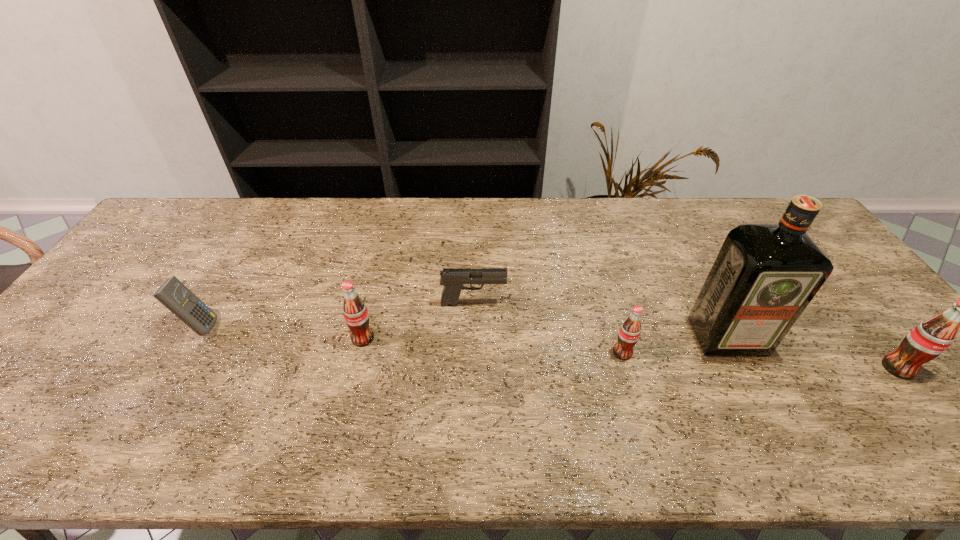
You are a GUI agent. You are given a task and a screenshot of the screen. Output one action in this format:
    pyautogui.click(x=<x>, y=<y>)
    Task: Click on the unoccupied position between the second soda from left to right and the fifth object from left to right
    Image resolution: width=960 pixels, height=540 pixels.
    Given the screenshot: What is the action you would take?
    pyautogui.click(x=675, y=345)

Locate an element on the screen. The image size is (960, 540). vacant area that lies between the rightmost object and the farthest object is located at coordinates (685, 335).

You are a GUI agent. You are given a task and a screenshot of the screen. Output one action in this format:
    pyautogui.click(x=<x>, y=<y>)
    Task: Click on the unoccupied position between the fifth object from left to right and the fourth object from right to left
    The height and width of the screenshot is (540, 960).
    Given the screenshot: What is the action you would take?
    pyautogui.click(x=600, y=320)

Where is `vacant region between the rightmost object and the second soda from right to left`? This screenshot has width=960, height=540. vacant region between the rightmost object and the second soda from right to left is located at coordinates (760, 360).

Image resolution: width=960 pixels, height=540 pixels. Find the location of `vacant region between the fourth object from left to right and the rightmost soda`. vacant region between the fourth object from left to right and the rightmost soda is located at coordinates (760, 360).

The image size is (960, 540). What are the coordinates of `free space between the second tallest soda and the fourth object from left to right` in the screenshot? It's located at (492, 346).

You are a GUI agent. You are given a task and a screenshot of the screen. Output one action in this format:
    pyautogui.click(x=<x>, y=<y>)
    Task: Click on the vacant space that's between the second shortest soda and the fifth object from left to right
    This screenshot has height=540, width=960.
    Given the screenshot: What is the action you would take?
    pyautogui.click(x=545, y=338)

I want to click on free space between the second object from left to right and the leftmost object, so click(281, 332).

Identify the location of empty space that is in between the rightmost object and the leftmost object. This screenshot has height=540, width=960. (549, 347).

Find the location of a particular element. vacant space in between the tallest object and the shortest object is located at coordinates coord(600,320).